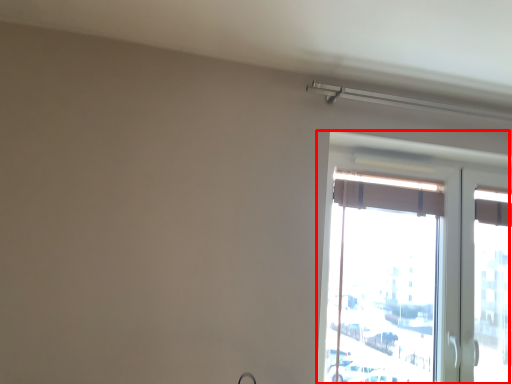
Question: Considering the relative positions of window (annotated by the red box) and curtain in the image provided, where is window (annotated by the red box) located with respect to the staircase?

Choices:
 (A) right
 (B) left

Answer: (A)